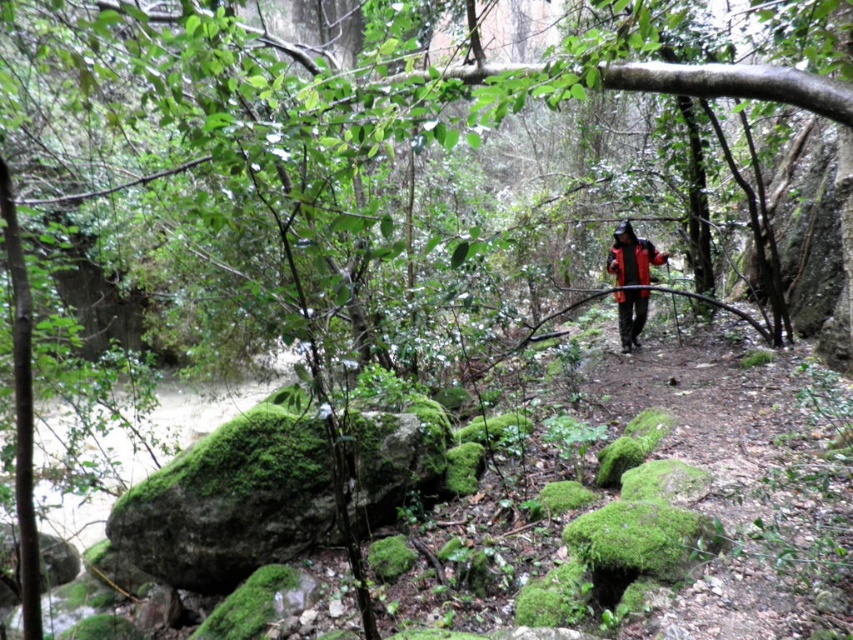
Question: Can you confirm if green mossy rock at lower left is positioned above red matte jacket at center?

Choices:
 (A) yes
 (B) no

Answer: (B)

Question: Among these objects, which one is farthest from the camera?

Choices:
 (A) red matte jacket at center
 (B) green mossy rock at lower left

Answer: (A)

Question: Which of the following is the closest to the observer?

Choices:
 (A) (175, 529)
 (B) (637, 256)

Answer: (A)

Question: Does green mossy rock at lower left have a lesser width compared to red matte jacket at center?

Choices:
 (A) yes
 (B) no

Answer: (B)

Question: Is green mossy rock at lower left wider than red matte jacket at center?

Choices:
 (A) yes
 (B) no

Answer: (A)